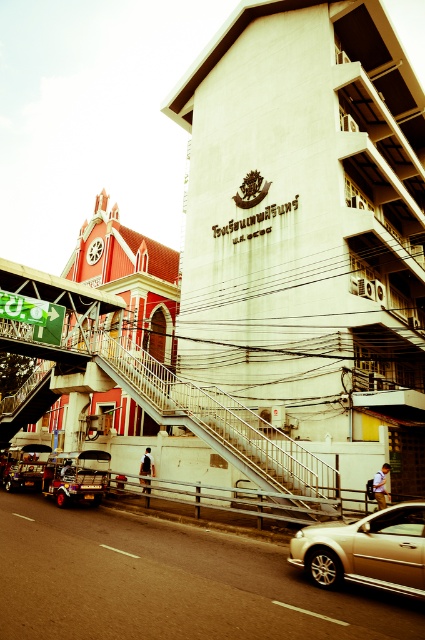
Does gold metallic car at lower right have a smaller size compared to metallic gold tuk-tuk at lower left?

Indeed, gold metallic car at lower right has a smaller size compared to metallic gold tuk-tuk at lower left.

Which is in front, point (408, 572) or point (71, 490)?

Point (408, 572)

Find the location of `gold metallic car at lower right`. gold metallic car at lower right is located at coordinates (365, 550).

Identify the location of metallic gold tuk-tuk at lower left. Image resolution: width=425 pixels, height=640 pixels. (73, 483).

Between point (90, 493) and point (30, 467), which one is positioned in front?

Point (90, 493) is in front.

Does point (79, 474) come farther from viewer compared to point (13, 465)?

No, (79, 474) is closer to viewer.

Image resolution: width=425 pixels, height=640 pixels. What are the coordinates of `metallic gold tuk-tuk at lower left` in the screenshot? It's located at (73, 483).

Does gold metallic car at lower right lie behind shiny black tuk-tuk at lower left?

No, gold metallic car at lower right is closer to the viewer.

Is gold metallic car at lower right bigger than shiny black tuk-tuk at lower left?

Actually, gold metallic car at lower right might be smaller than shiny black tuk-tuk at lower left.

Is point (394, 582) positioned before point (17, 467)?

That is True.

Where is `gold metallic car at lower right`? This screenshot has width=425, height=640. gold metallic car at lower right is located at coordinates (365, 550).